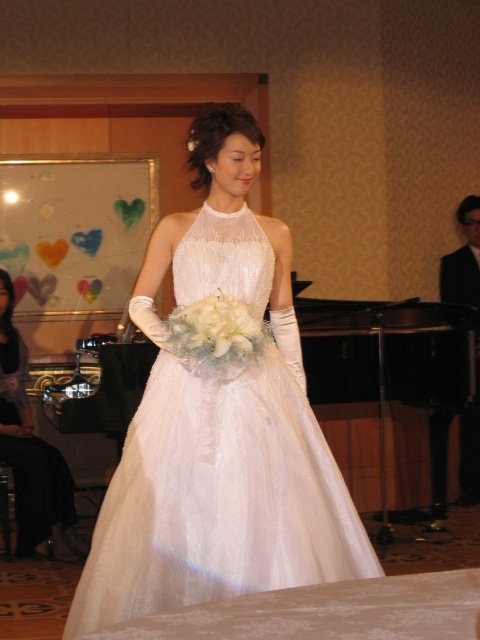
Between white satin dress at center and white silk bouquet at center, which one is positioned higher?

white silk bouquet at center is higher up.

Consider the image. Is white satin dress at center below white silk bouquet at center?

Indeed, white satin dress at center is positioned under white silk bouquet at center.

Locate an element on the screen. white satin dress at center is located at coordinates (219, 422).

Does matte white dress at center appear on the left side of white silk bouquet at center?

Correct, you'll find matte white dress at center to the left of white silk bouquet at center.

Does matte white dress at center have a greater width compared to white silk bouquet at center?

Correct, the width of matte white dress at center exceeds that of white silk bouquet at center.

Identify the location of matte white dress at center. (32, 452).

Is point (203, 372) in front of point (31, 468)?

Yes, point (203, 372) is closer to viewer.

Who is higher up, white satin dress at center or matte white dress at center?

white satin dress at center is above.

Locate an element on the screen. white satin dress at center is located at coordinates (219, 422).

Locate an element on the screen. white satin dress at center is located at coordinates (219, 422).